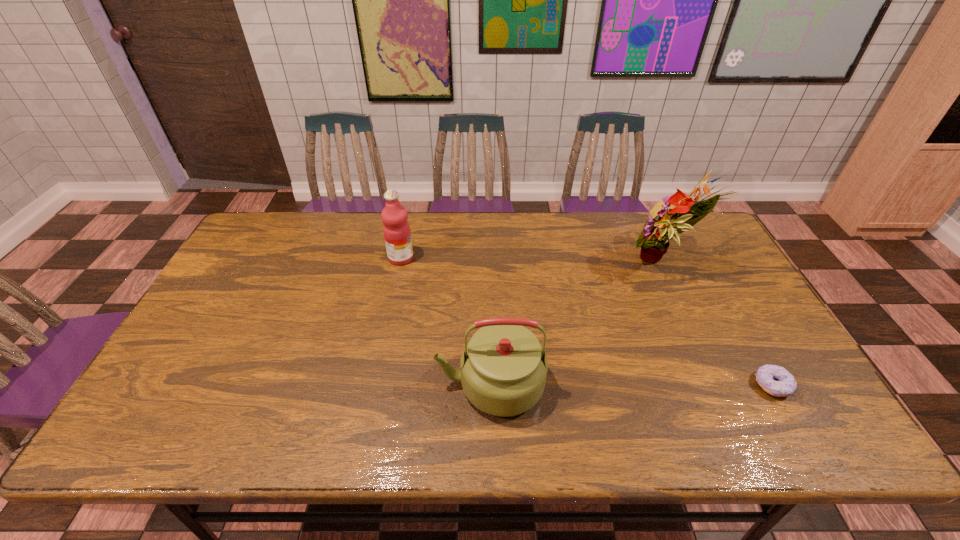
You are a GUI agent. You are given a task and a screenshot of the screen. Output one action in this format:
    pyautogui.click(x=<x>, y=<y>)
    Task: Click on the vacant space at the left edge
    This screenshot has height=540, width=960.
    Given the screenshot: What is the action you would take?
    pyautogui.click(x=211, y=387)

The width and height of the screenshot is (960, 540). Identify the location of blank space at the right edge of the desktop. (731, 282).

You are a GUI agent. You are given a task and a screenshot of the screen. Output one action in this format:
    pyautogui.click(x=<x>, y=<y>)
    Task: Click on the free space at the far left corner
    
    Given the screenshot: What is the action you would take?
    pyautogui.click(x=268, y=238)

Locate an element on the screen. This screenshot has height=540, width=960. vacant area at the near left corner of the desktop is located at coordinates (189, 414).

The height and width of the screenshot is (540, 960). I want to click on vacant area that lies between the doughnut and the bouquet, so point(718,324).

Where is `free space between the shortest object and the tallest object`? Image resolution: width=960 pixels, height=540 pixels. free space between the shortest object and the tallest object is located at coordinates (718, 324).

This screenshot has height=540, width=960. Identify the location of free space between the fruit juice and the tallest object. point(532,260).

In order to click on vacant space in between the doughnut and the third object from right to left in this screenshot , I will do `click(631, 384)`.

I want to click on vacant region between the leftmost object and the third object from right to left, so click(445, 321).

At what (x,y) coordinates should I click in order to perform the action: click on free space between the fruit juice and the third object from right to left. Please return your answer as a coordinate pair (x, y). The height and width of the screenshot is (540, 960). Looking at the image, I should click on (445, 321).